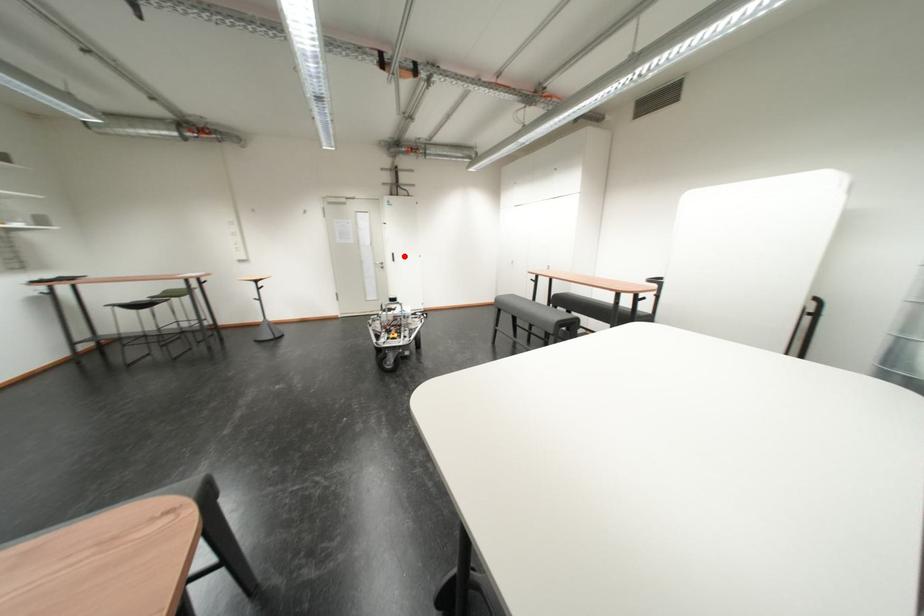
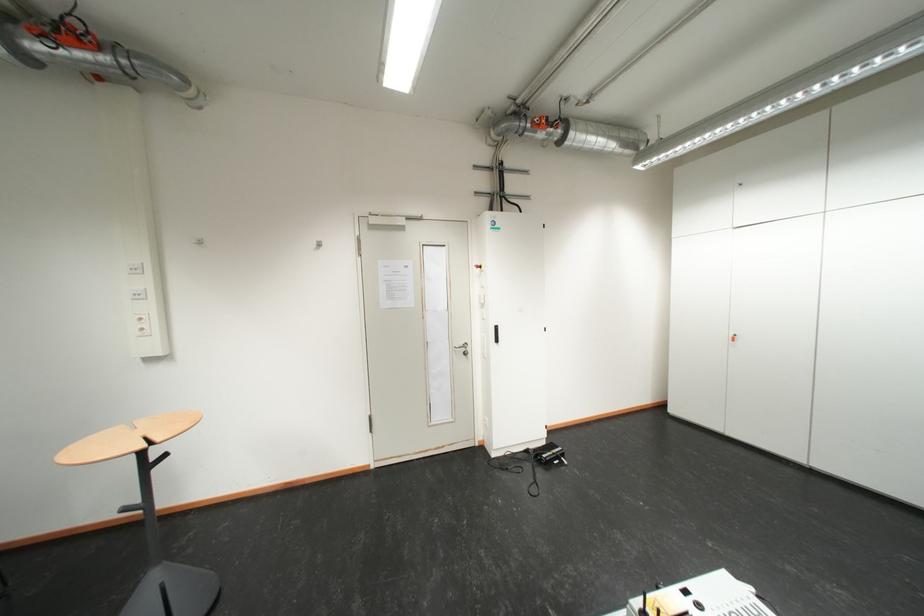
The point at the highlighted location is marked in the first image. Where is the corresponding point in the second image?

(507, 330)